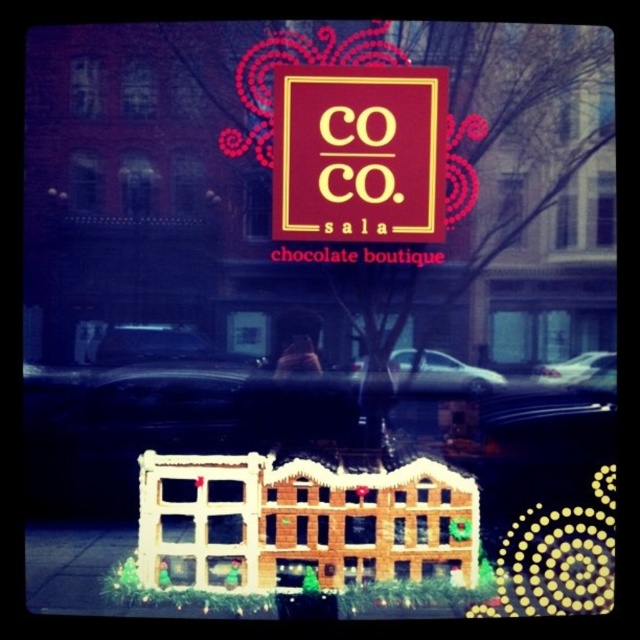
You are standing in front of the CoCo Sala Chocolate Boutique storefront display. There are two points marked on the display. The first point is at coordinates point (x=422, y=99) and the second point is at point (x=614, y=352). From your perspective, which point is closer to you?

Point (x=422, y=99) is in front of point (x=614, y=352), so it is closer to you.

You are standing 6 feet away from the storefront display. Can you reach the maroon matte sign at center without moving closer?

The maroon matte sign at center is 5.22 feet away from the camera, so you are standing 6 feet away from it. Since the distance between you and the sign is greater than your reach, you cannot reach it without moving closer.

You are a customer standing in front of the CoCo Sala Chocolate Boutique storefront display. You notice two cars, a black glossy car at center and a metallic silver car at center. Which car is shorter?

The black glossy car at center is shorter than the metallic silver car at center.